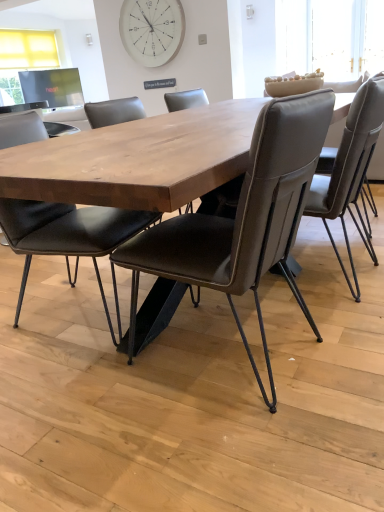
Question: From a real-world perspective, is matte black chair at center, positioned as the 1th chair in left-to-right order, located higher than brown leather chair at center, the 2th chair viewed from the left?

Choices:
 (A) no
 (B) yes

Answer: (A)

Question: Can you confirm if matte black chair at center, which ranks as the 3th chair in right-to-left order, is bigger than brown leather chair at center, the 2th chair viewed from the left?

Choices:
 (A) yes
 (B) no

Answer: (A)

Question: From the image's perspective, is matte black chair at center, positioned as the 1th chair in left-to-right order, over brown leather chair at center, the 2th chair viewed from the left?

Choices:
 (A) yes
 (B) no

Answer: (A)

Question: Is the position of matte black chair at center, positioned as the 1th chair in left-to-right order, less distant than that of brown leather chair at center, which is the second chair from right to left?

Choices:
 (A) no
 (B) yes

Answer: (A)

Question: Considering the relative sizes of matte black chair at center, positioned as the 1th chair in left-to-right order, and brown leather chair at center, which is the second chair from right to left, in the image provided, is matte black chair at center, positioned as the 1th chair in left-to-right order, smaller than brown leather chair at center, which is the second chair from right to left,?

Choices:
 (A) no
 (B) yes

Answer: (A)

Question: From the image's perspective, relative to brown leather chair at center, the 2th chair viewed from the left, is white wooden clock at upper center above or below?

Choices:
 (A) above
 (B) below

Answer: (A)

Question: From their relative heights in the image, would you say white wooden clock at upper center is taller or shorter than brown leather chair at center, which is the second chair from right to left?

Choices:
 (A) tall
 (B) short

Answer: (B)

Question: Considering the positions of white wooden clock at upper center and brown leather chair at center, the 2th chair viewed from the left, in the image, is white wooden clock at upper center bigger or smaller than brown leather chair at center, the 2th chair viewed from the left,?

Choices:
 (A) big
 (B) small

Answer: (B)

Question: Do you think white wooden clock at upper center is within brown leather chair at center, the 2th chair viewed from the left, or outside of it?

Choices:
 (A) inside
 (B) outside

Answer: (B)

Question: Is leather-like chair at center, marked as the 1th chair in a right-to-left arrangement, wider or thinner than white wooden clock at upper center?

Choices:
 (A) thin
 (B) wide

Answer: (B)

Question: From their relative heights in the image, would you say leather-like chair at center, the third chair positioned from the left, is taller or shorter than white wooden clock at upper center?

Choices:
 (A) short
 (B) tall

Answer: (B)

Question: Considering the positions of point (355, 144) and point (148, 14), is point (355, 144) closer or farther from the camera than point (148, 14)?

Choices:
 (A) closer
 (B) farther

Answer: (A)

Question: From a real-world perspective, relative to white wooden clock at upper center, is leather-like chair at center, marked as the 1th chair in a right-to-left arrangement, vertically above or below?

Choices:
 (A) above
 (B) below

Answer: (B)

Question: Considering the positions of matte black chair at center, which ranks as the 3th chair in right-to-left order, and brown leather chair at center, the 2th chair viewed from the left, in the image, is matte black chair at center, which ranks as the 3th chair in right-to-left order, wider or thinner than brown leather chair at center, the 2th chair viewed from the left,?

Choices:
 (A) thin
 (B) wide

Answer: (A)

Question: Do you think matte black chair at center, which ranks as the 3th chair in right-to-left order, is within brown leather chair at center, which is the second chair from right to left, or outside of it?

Choices:
 (A) inside
 (B) outside

Answer: (B)